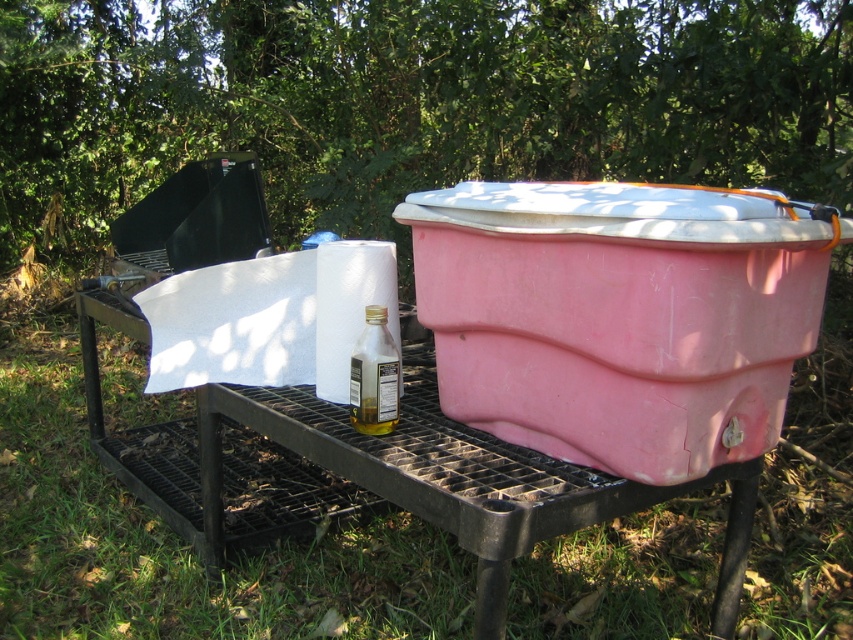
Locate an element on the screen. This screenshot has height=640, width=853. green grass at lower left is located at coordinates (178, 538).

Does point (30, 397) lie behind point (721, 392)?

Yes.

Is point (566, 541) closer to viewer compared to point (483, 387)?

No, it is behind (483, 387).

Locate an element on the screen. The height and width of the screenshot is (640, 853). green grass at lower left is located at coordinates click(178, 538).

Which of these two, pink plastic cooler at center or clear glass bottle at center, stands shorter?

Standing shorter between the two is clear glass bottle at center.

Where is `pink plastic cooler at center`? This screenshot has height=640, width=853. pink plastic cooler at center is located at coordinates (618, 316).

At what (x,y) coordinates should I click in order to perform the action: click on pink plastic cooler at center. Please return your answer as a coordinate pair (x, y). The image size is (853, 640). Looking at the image, I should click on (618, 316).

Is green grass at lower left closer to the viewer compared to clear glass bottle at center?

That is False.

Does green grass at lower left appear over clear glass bottle at center?

No, green grass at lower left is not above clear glass bottle at center.

Locate an element on the screen. This screenshot has height=640, width=853. green grass at lower left is located at coordinates (178, 538).